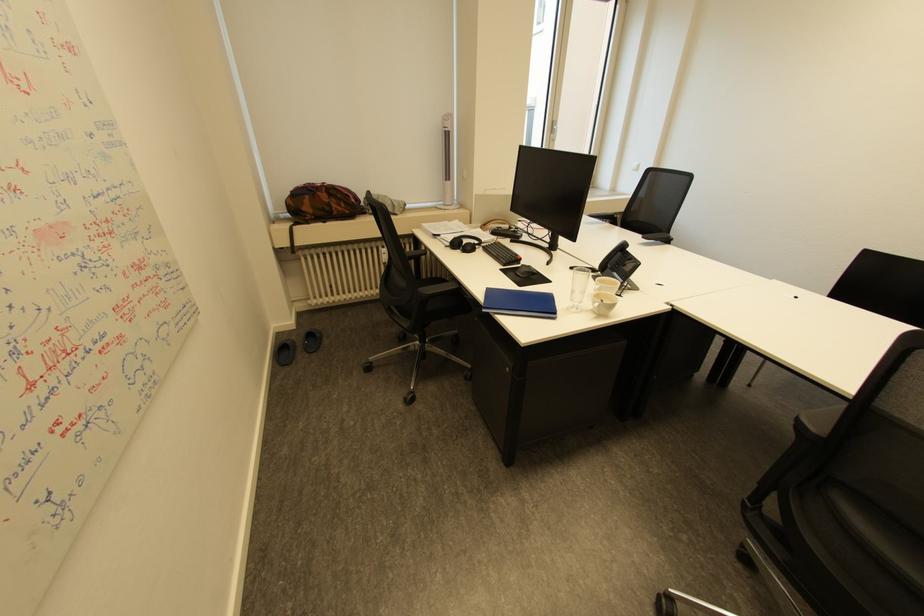
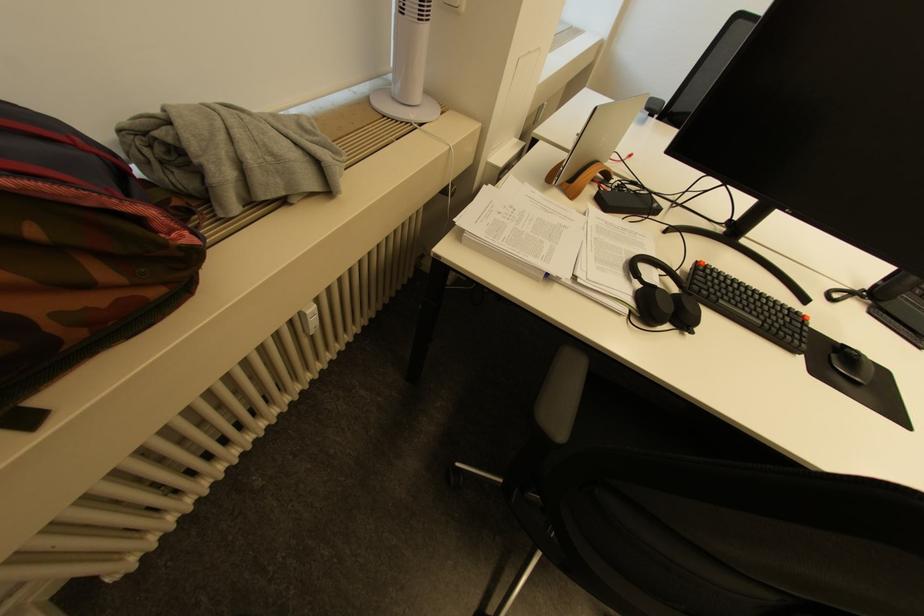
Where in the second image is the point corresponding to point (489, 224) from the first image?

(574, 177)